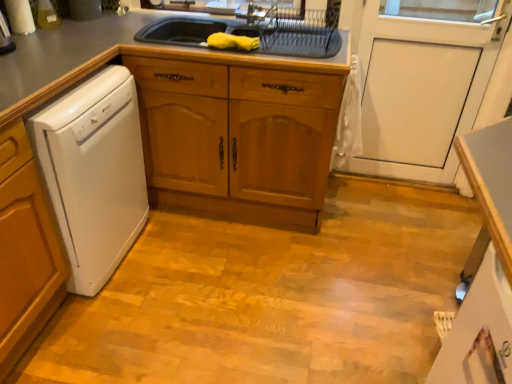
What are the coordinates of `space that is in front of gray matte countertop at upper center` in the screenshot? It's located at (206, 286).